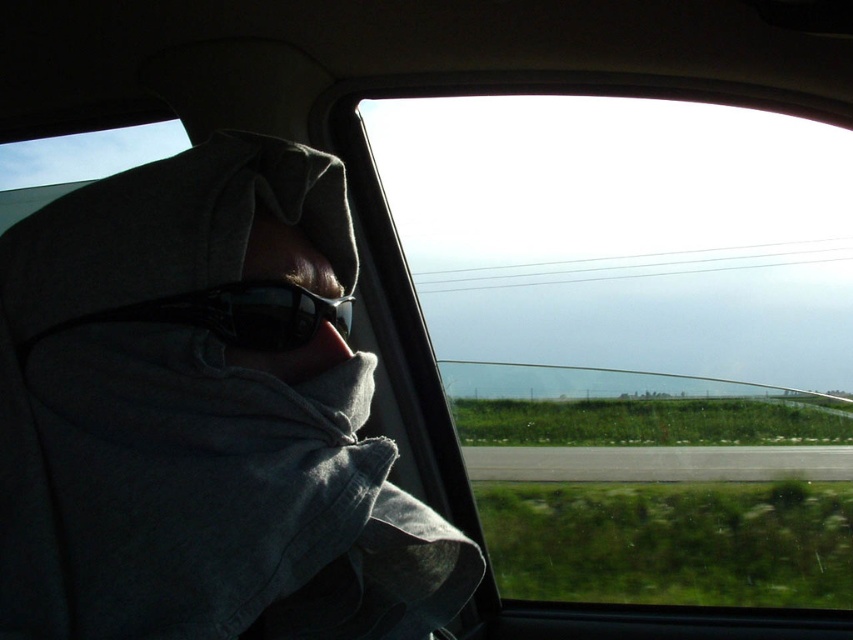
Is gray fabric at left shorter than black plastic goggles at left?

No, gray fabric at left is not shorter than black plastic goggles at left.

Does gray fabric at left have a lesser width compared to black plastic goggles at left?

In fact, gray fabric at left might be wider than black plastic goggles at left.

This screenshot has height=640, width=853. Describe the element at coordinates (202, 419) in the screenshot. I see `gray fabric at left` at that location.

Identify the location of gray fabric at left. This screenshot has height=640, width=853. (202, 419).

Based on the photo, who is taller, transparent glass car window at center or matte black sunglasses at center?

Standing taller between the two is transparent glass car window at center.

Who is positioned more to the left, transparent glass car window at center or matte black sunglasses at center?

Positioned to the left is matte black sunglasses at center.

Who is more forward, (815, 224) or (288, 268)?

Point (288, 268)

Where is `transparent glass car window at center`? The height and width of the screenshot is (640, 853). transparent glass car window at center is located at coordinates (637, 339).

Is transparent glass car window at center wider than black reflective sunglasses at center?

Yes.

Is transparent glass car window at center to the left of black reflective sunglasses at center from the viewer's perspective?

Incorrect, transparent glass car window at center is not on the left side of black reflective sunglasses at center.

Identify the location of transparent glass car window at center. This screenshot has width=853, height=640. (637, 339).